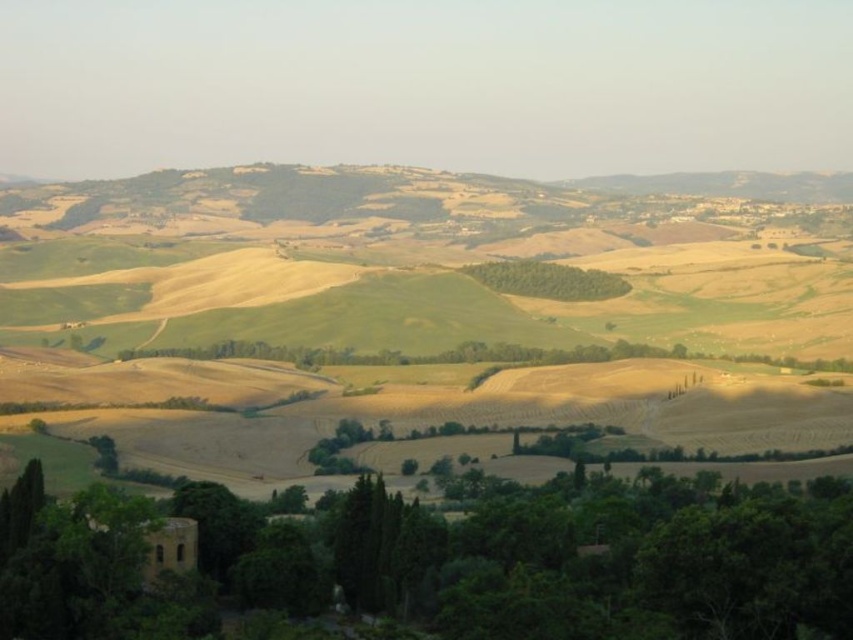
Question: Is green leafy tree at lower center positioned at the back of green leafy trees at center?

Choices:
 (A) no
 (B) yes

Answer: (A)

Question: Can you confirm if green leafy tree at lower center is bigger than green leafy trees at center?

Choices:
 (A) no
 (B) yes

Answer: (B)

Question: Among these points, which one is nearest to the camera?

Choices:
 (A) (614, 296)
 (B) (384, 552)

Answer: (B)

Question: Which point is farther to the camera?

Choices:
 (A) green leafy trees at center
 (B) green leafy tree at lower center

Answer: (A)

Question: Is green leafy tree at lower center thinner than green leafy trees at center?

Choices:
 (A) no
 (B) yes

Answer: (A)